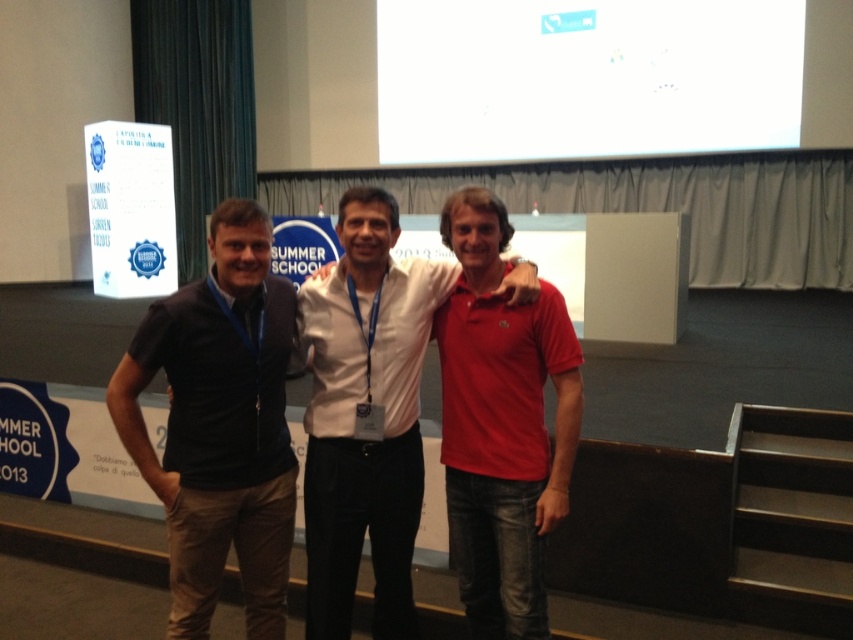
Question: Which object is closer to the camera taking this photo?

Choices:
 (A) white cotton shirt at center
 (B) dark blue jersey at left
 (C) red cotton polo shirt at center
 (D) white matte projection screen at upper center

Answer: (B)

Question: Can you confirm if dark blue jersey at left is positioned above red cotton polo shirt at center?

Choices:
 (A) no
 (B) yes

Answer: (A)

Question: Is white matte projection screen at upper center behind dark blue jersey at left?

Choices:
 (A) yes
 (B) no

Answer: (A)

Question: From the image, what is the correct spatial relationship of white matte projection screen at upper center in relation to white cotton shirt at center?

Choices:
 (A) below
 (B) above

Answer: (B)

Question: Among these points, which one is nearest to the camera?

Choices:
 (A) click(254, 572)
 (B) click(517, 500)
 (C) click(358, 435)
 (D) click(680, 29)

Answer: (B)

Question: Considering the real-world distances, which object is closest to the white cotton shirt at center?

Choices:
 (A) red cotton polo shirt at center
 (B) white matte projection screen at upper center
 (C) dark blue jersey at left

Answer: (A)